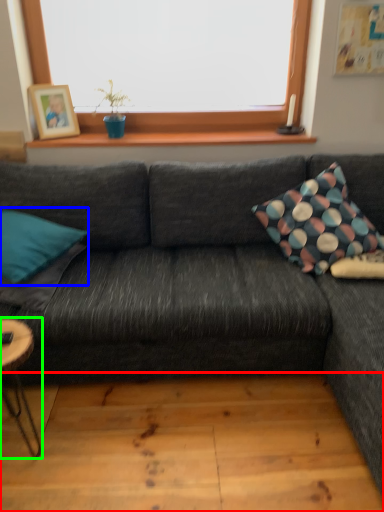
Question: Which object is positioned closest to plank (highlighted by a red box)? Select from pillow (highlighted by a blue box) and coffee table (highlighted by a green box).

Choices:
 (A) pillow
 (B) coffee table

Answer: (B)